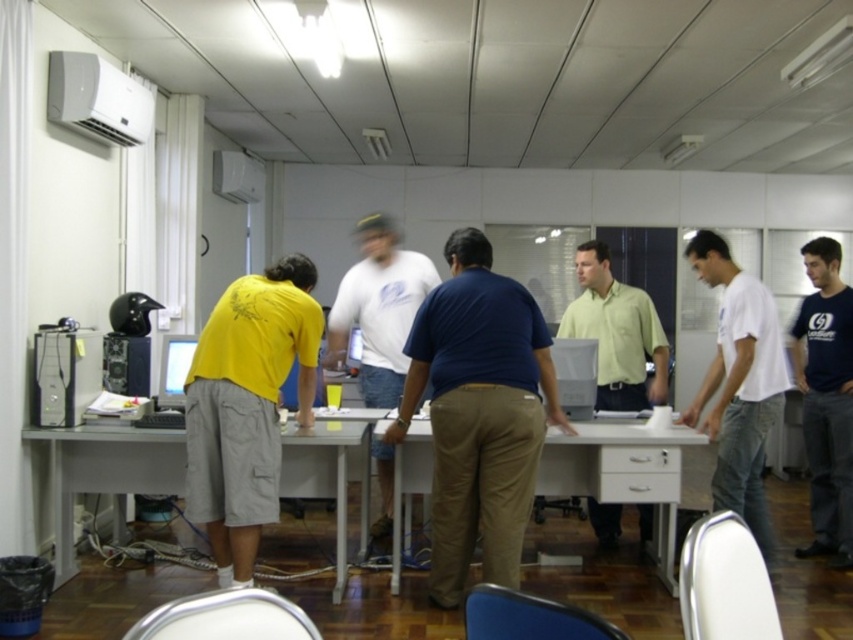
You are standing in the office and want to place a large document on the white glossy table at center so that it can be easily seen by the person wearing the light green shirt at center. Is the table positioned in a way that allows the person to see the document clearly?

The white glossy table at center is closer to the viewer than the light green shirt at center, so the person wearing the light green shirt at center is further away from the table. This means the document placed on the white glossy table at center may not be easily visible to them unless they move closer.